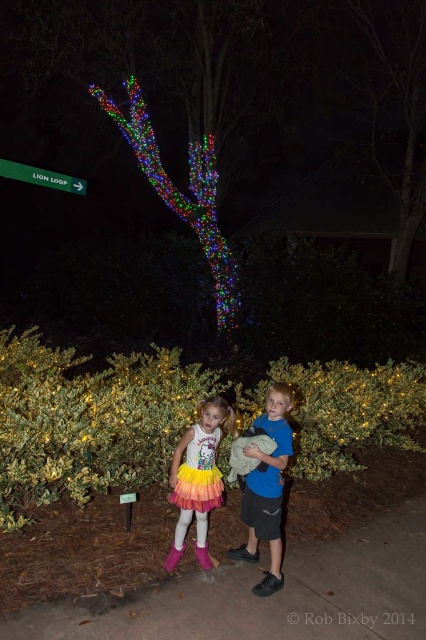
Who is more forward, [259,515] or [43,177]?

Point [259,515] is in front.

Can you confirm if blue fabric shirt at center is thinner than green plastic sign at upper left?

No, blue fabric shirt at center is not thinner than green plastic sign at upper left.

Where is `blue fabric shirt at center`? The width and height of the screenshot is (426, 640). blue fabric shirt at center is located at coordinates (267, 488).

Is green leafy bush at lower center to the left of pink rubber boot at lower center from the viewer's perspective?

Correct, you'll find green leafy bush at lower center to the left of pink rubber boot at lower center.

Can you confirm if green leafy bush at lower center is bigger than pink rubber boot at lower center?

Yes, green leafy bush at lower center is bigger than pink rubber boot at lower center.

Who is more distant from viewer, (x=16, y=339) or (x=173, y=560)?

The point (x=16, y=339) is behind.

The image size is (426, 640). I want to click on green leafy bush at lower center, so click(88, 420).

Measure the distance between point (406, 420) and camera.

They are 6.13 meters apart.

In the scene shown: Which is above, green leafy bush at lower center or green plastic sign at upper left?

Positioned higher is green plastic sign at upper left.

Is point (132, 372) in front of point (69, 188)?

That is True.

This screenshot has height=640, width=426. In order to click on green leafy bush at lower center in this screenshot , I will do `click(88, 420)`.